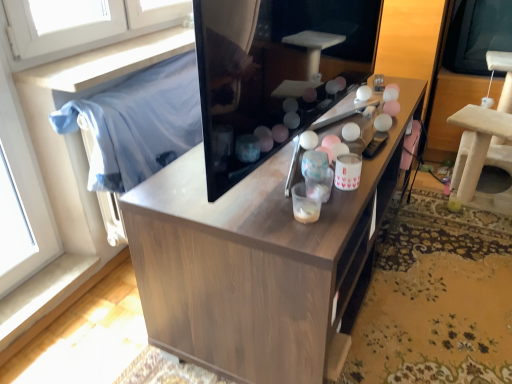
Question: In the image, is wooden cabinet at center positioned in front of or behind transparent plastic window screen at upper right?

Choices:
 (A) behind
 (B) front

Answer: (B)

Question: In terms of width, does wooden cabinet at center look wider or thinner when compared to transparent plastic window screen at upper right?

Choices:
 (A) thin
 (B) wide

Answer: (B)

Question: Which is nearer to the wooden cabinet at center?

Choices:
 (A) transparent plastic window screen at upper right
 (B) blue fabric at left
 (C) beige carpeted cat tree at right

Answer: (B)

Question: Estimate the real-world distances between objects in this image. Which object is farther from the wooden cabinet at center?

Choices:
 (A) transparent plastic window screen at upper right
 (B) beige carpeted cat tree at right
 (C) blue fabric at left

Answer: (A)